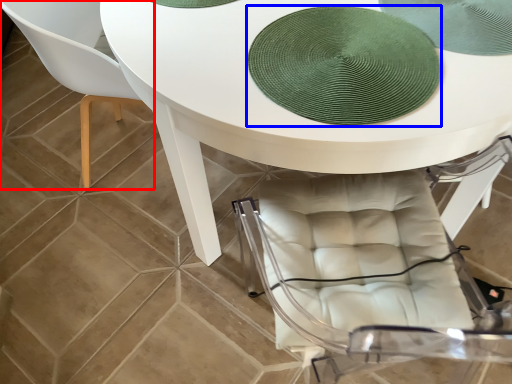
Question: Which point is closer to the camera, chair (highlighted by a red box) or mat (highlighted by a blue box)?

Choices:
 (A) chair
 (B) mat

Answer: (B)